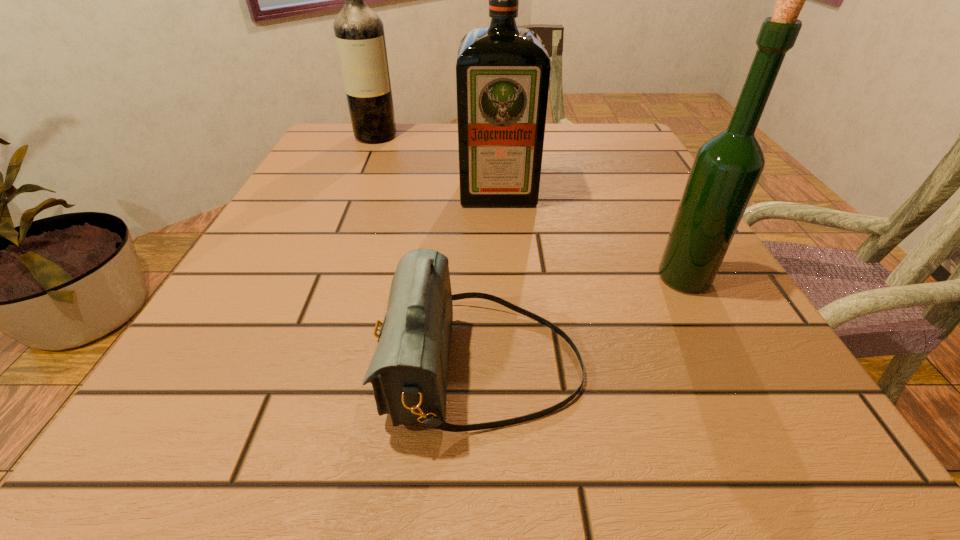
The image size is (960, 540). Find the location of `the leftmost object`. the leftmost object is located at coordinates (359, 32).

Where is `the farthest object`? The height and width of the screenshot is (540, 960). the farthest object is located at coordinates (359, 32).

Locate an element on the screen. the second nearest object is located at coordinates (726, 169).

Where is `the rightmost liquor`? The image size is (960, 540). the rightmost liquor is located at coordinates (726, 169).

Where is `the second farthest object`? the second farthest object is located at coordinates (503, 72).

At what (x,y) coordinates should I click in order to perform the action: click on the second liquor from left to right. Please return your answer as a coordinate pair (x, y). Looking at the image, I should click on (503, 72).

At what (x,y) coordinates should I click in order to perform the action: click on the shortest object. Please return your answer as a coordinate pair (x, y). This screenshot has height=540, width=960. Looking at the image, I should click on (408, 372).

Where is `the nearest object`? the nearest object is located at coordinates (408, 372).

Where is `vacant space positioned 0.110m on the front-facing side of the farthest liquor`? vacant space positioned 0.110m on the front-facing side of the farthest liquor is located at coordinates (363, 166).

Find the location of a particular element. The width and height of the screenshot is (960, 540). free space located on the back of the rightmost liquor is located at coordinates (624, 165).